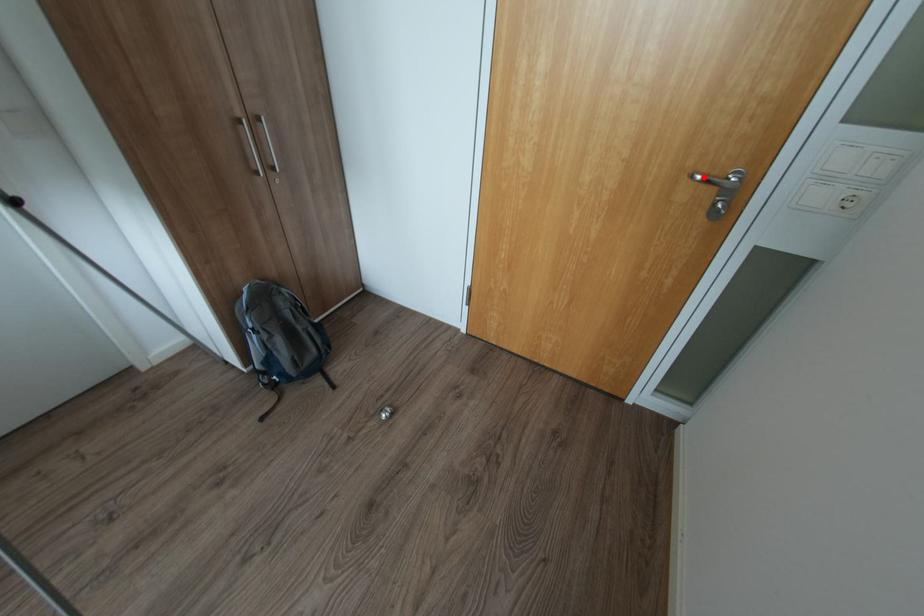
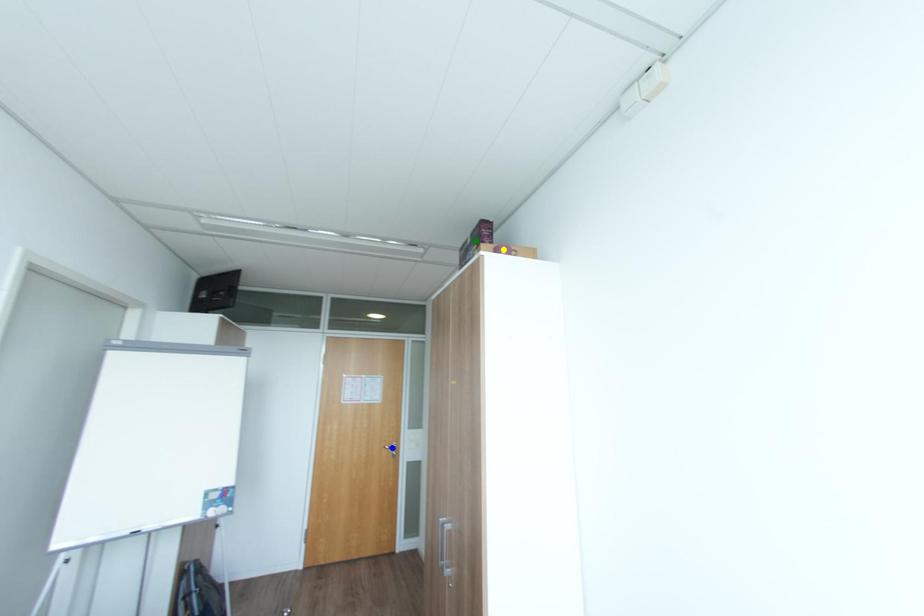
Question: I am providing you with two images of the same scene from different viewpoints. A red point is marked on the first image. You are given multiple points on the second image. Which point in image 2 represents the same 3d spot as the red point in image 1?

Choices:
 (A) green point
 (B) yellow point
 (C) blue point

Answer: (C)